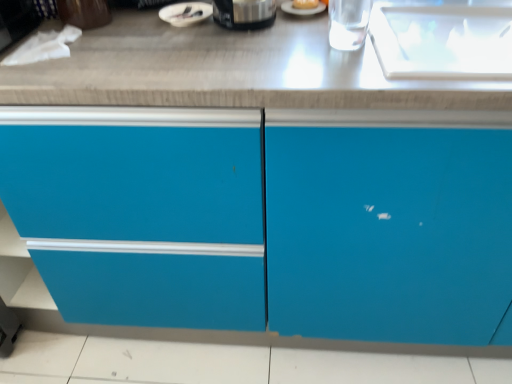
I want to click on free region under satin black coffee maker at upper center, the 2th appliance positioned from the left (from a real-world perspective), so click(245, 30).